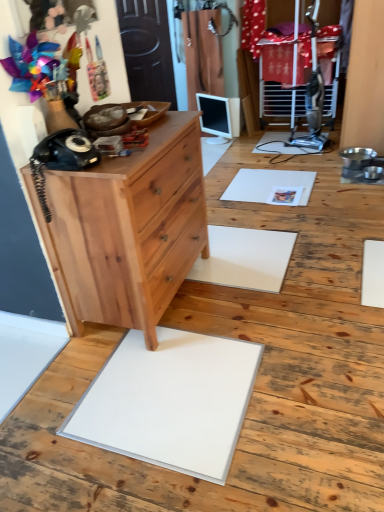
Question: Can you confirm if black matte rotary phone at left is shorter than natural wood chest of drawers at left?

Choices:
 (A) no
 (B) yes

Answer: (B)

Question: Is black matte rotary phone at left not near natural wood chest of drawers at left?

Choices:
 (A) no
 (B) yes

Answer: (A)

Question: Can you confirm if black matte rotary phone at left is positioned to the left of natural wood chest of drawers at left?

Choices:
 (A) yes
 (B) no

Answer: (A)

Question: Considering the relative sizes of black matte rotary phone at left and natural wood chest of drawers at left in the image provided, is black matte rotary phone at left wider than natural wood chest of drawers at left?

Choices:
 (A) yes
 (B) no

Answer: (B)

Question: From a real-world perspective, is black matte rotary phone at left positioned over natural wood chest of drawers at left based on gravity?

Choices:
 (A) yes
 (B) no

Answer: (A)

Question: Is black matte rotary phone at left further to camera compared to natural wood chest of drawers at left?

Choices:
 (A) yes
 (B) no

Answer: (B)

Question: Does natural wood dresser at left have a lesser width compared to natural wood chest of drawers at left?

Choices:
 (A) yes
 (B) no

Answer: (B)

Question: Would you consider natural wood dresser at left to be distant from natural wood chest of drawers at left?

Choices:
 (A) no
 (B) yes

Answer: (A)

Question: Does natural wood dresser at left have a lesser height compared to natural wood chest of drawers at left?

Choices:
 (A) yes
 (B) no

Answer: (A)

Question: Does natural wood dresser at left touch natural wood chest of drawers at left?

Choices:
 (A) yes
 (B) no

Answer: (B)

Question: Is natural wood dresser at left positioned in front of natural wood chest of drawers at left?

Choices:
 (A) no
 (B) yes

Answer: (A)

Question: Is the position of natural wood dresser at left more distant than that of natural wood chest of drawers at left?

Choices:
 (A) yes
 (B) no

Answer: (A)

Question: Is black matte rotary phone at left in front of natural wood dresser at left?

Choices:
 (A) no
 (B) yes

Answer: (B)